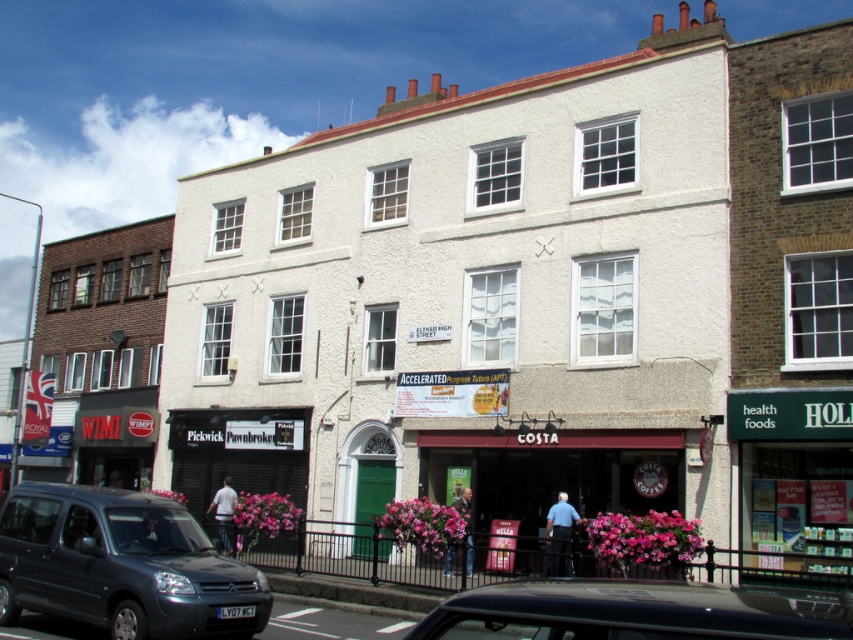
Does black matte car at lower center come in front of brown wooden costa coffee shop at center?

Yes, black matte car at lower center is in front of brown wooden costa coffee shop at center.

Between black matte car at lower center and brown wooden costa coffee shop at center, which one appears on the right side from the viewer's perspective?

brown wooden costa coffee shop at center is more to the right.

Locate an element on the screen. This screenshot has height=640, width=853. black matte car at lower center is located at coordinates (634, 612).

Locate an element on the screen. This screenshot has width=853, height=640. black matte car at lower center is located at coordinates (634, 612).

Can you confirm if matte black car at lower left is wider than brown wooden costa coffee shop at center?

A: Correct, the width of matte black car at lower left exceeds that of brown wooden costa coffee shop at center.

Does matte black car at lower left appear over brown wooden costa coffee shop at center?

Incorrect, matte black car at lower left is not positioned above brown wooden costa coffee shop at center.

Between point (194, 531) and point (451, 458), which one is positioned behind?

The point (451, 458) is more distant.

Locate an element on the screen. matte black car at lower left is located at coordinates point(122,564).

Is point (67, 618) closer to viewer compared to point (798, 625)?

That is False.

Is matte black car at lower left further to camera compared to black matte car at lower center?

Answer: Yes, it is behind black matte car at lower center.

Which is in front, point (183, 525) or point (563, 604)?

Point (563, 604) is in front.

This screenshot has height=640, width=853. I want to click on matte black car at lower left, so pyautogui.click(x=122, y=564).